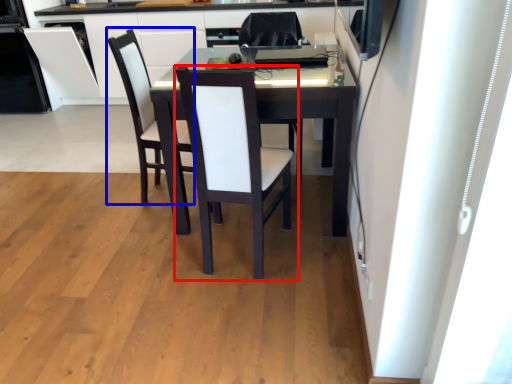
Question: Among these objects, which one is farthest to the camera, chair (highlighted by a red box) or armchair (highlighted by a blue box)?

Choices:
 (A) chair
 (B) armchair

Answer: (B)